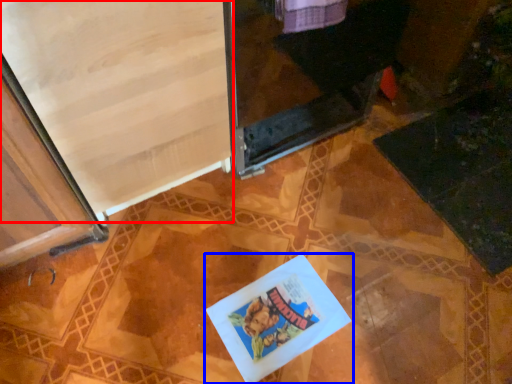
Question: Which object appears farthest to the camera in this image, screen door (highlighted by a red box) or book (highlighted by a blue box)?

Choices:
 (A) screen door
 (B) book

Answer: (B)